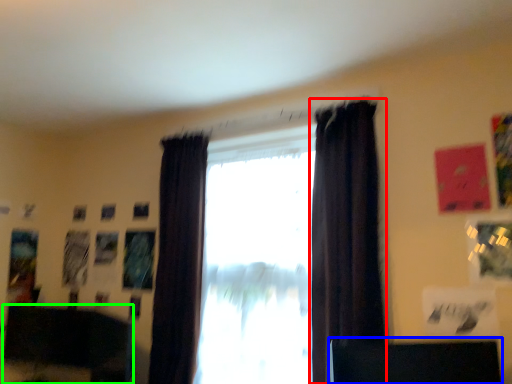
Question: Which is nearer to the curtain (highlighted by a red box)? furniture (highlighted by a blue box) or furniture (highlighted by a green box).

Choices:
 (A) furniture
 (B) furniture

Answer: (A)